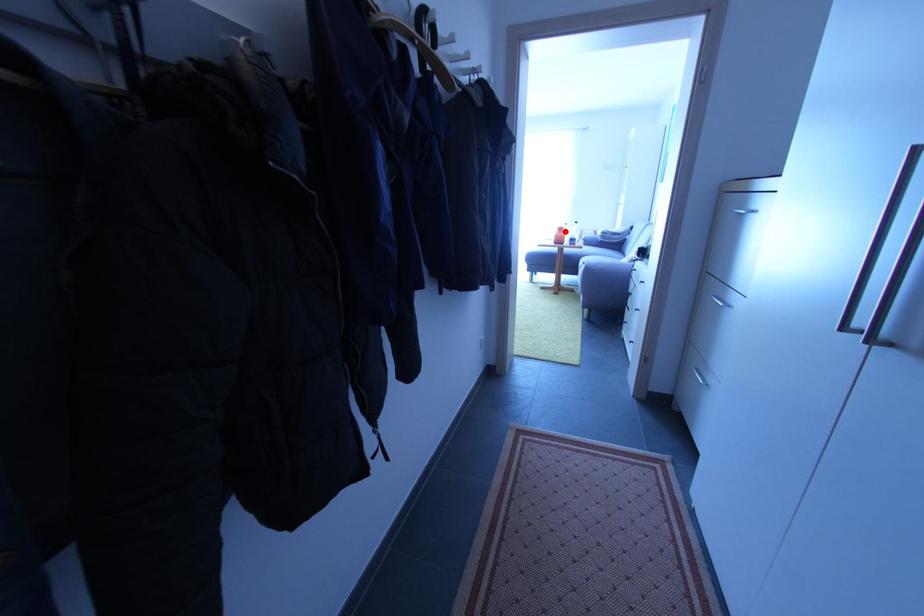
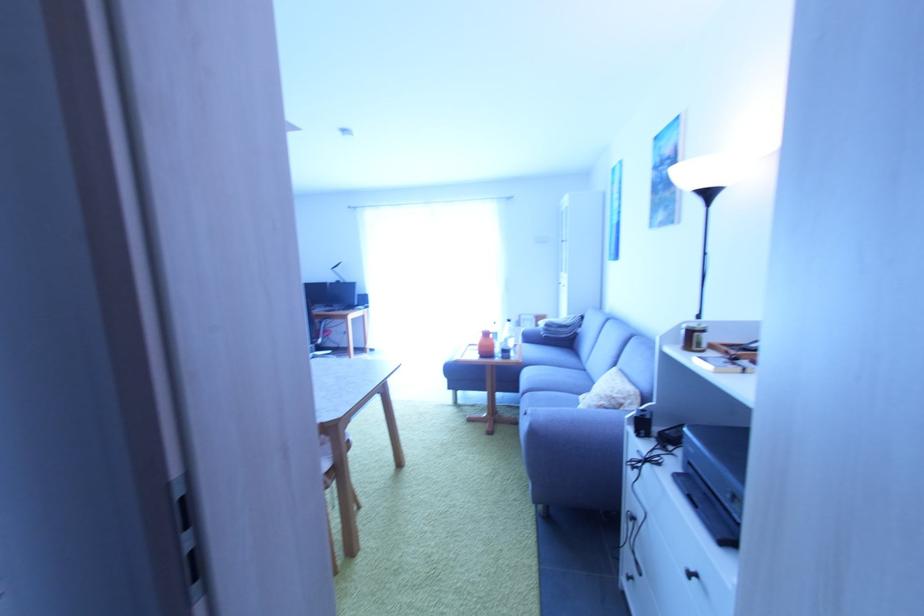
Locate, in the second image, the point that corresponds to the highlighted location in the first image.

(492, 336)